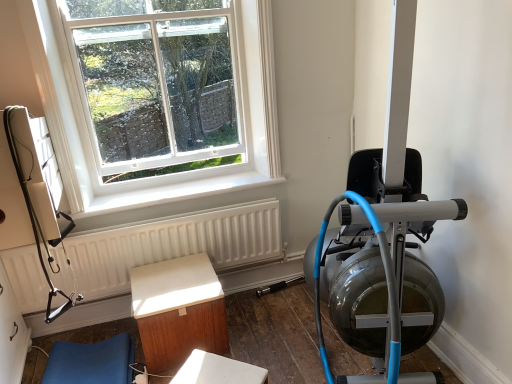
Question: Is light brown wood table at center, acting as the 2th furniture starting from the left, facing towards white glass window at upper left?

Choices:
 (A) yes
 (B) no

Answer: (B)

Question: From the image's perspective, does light brown wood table at center, the first furniture when ordered from right to left, appear lower than white glass window at upper left?

Choices:
 (A) no
 (B) yes

Answer: (B)

Question: Can you confirm if light brown wood table at center, acting as the 2th furniture starting from the left, is taller than white glass window at upper left?

Choices:
 (A) no
 (B) yes

Answer: (A)

Question: From the image's perspective, is light brown wood table at center, the first furniture when ordered from right to left, on white glass window at upper left?

Choices:
 (A) no
 (B) yes

Answer: (A)

Question: Would you say white glass window at upper left is part of light brown wood table at center, acting as the 2th furniture starting from the left,'s contents?

Choices:
 (A) yes
 (B) no

Answer: (B)

Question: Is light brown wood table at center, the first furniture when ordered from right to left, positioned with its back to white glass window at upper left?

Choices:
 (A) no
 (B) yes

Answer: (A)

Question: From the image's perspective, is blue rubber rowing machine at right above blue fabric cushion at lower left, the 2th furniture from the right?

Choices:
 (A) no
 (B) yes

Answer: (B)

Question: From a real-world perspective, is blue rubber rowing machine at right on blue fabric cushion at lower left, placed as the first furniture when sorted from left to right?

Choices:
 (A) yes
 (B) no

Answer: (A)

Question: From the image's perspective, is blue rubber rowing machine at right below blue fabric cushion at lower left, the 2th furniture from the right?

Choices:
 (A) yes
 (B) no

Answer: (B)

Question: Is blue rubber rowing machine at right touching blue fabric cushion at lower left, placed as the first furniture when sorted from left to right?

Choices:
 (A) yes
 (B) no

Answer: (B)

Question: Considering the relative sizes of blue rubber rowing machine at right and blue fabric cushion at lower left, placed as the first furniture when sorted from left to right, in the image provided, is blue rubber rowing machine at right wider than blue fabric cushion at lower left, placed as the first furniture when sorted from left to right,?

Choices:
 (A) yes
 (B) no

Answer: (B)

Question: Are blue rubber rowing machine at right and blue fabric cushion at lower left, the 2th furniture from the right, located far from each other?

Choices:
 (A) yes
 (B) no

Answer: (A)

Question: Is light brown wood table at center, the first furniture when ordered from right to left, bigger than blue rubber rowing machine at right?

Choices:
 (A) yes
 (B) no

Answer: (B)